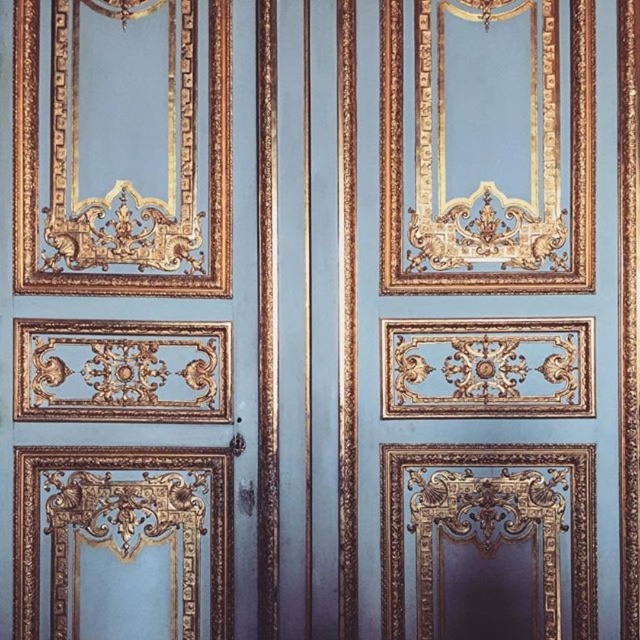
Question: Considering the relative positions of gold metallic door at center and matte gold door at center in the image provided, where is gold metallic door at center located with respect to matte gold door at center?

Choices:
 (A) left
 (B) right

Answer: (B)

Question: From the image, what is the correct spatial relationship of gold metallic door at center in relation to matte gold door at center?

Choices:
 (A) right
 (B) left

Answer: (A)

Question: Which point is farther from the camera taking this photo?

Choices:
 (A) (176, 81)
 (B) (412, 42)

Answer: (B)

Question: Is gold metallic door at center closer to the viewer compared to matte gold door at center?

Choices:
 (A) no
 (B) yes

Answer: (A)